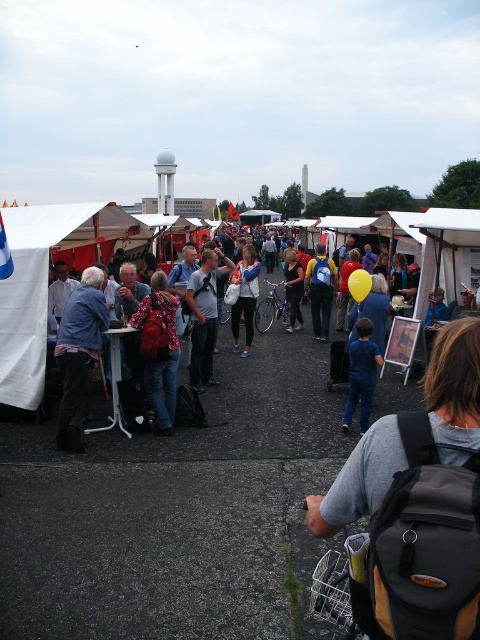
Question: Among these points, which one is nearest to the camera?

Choices:
 (A) (237, 272)
 (B) (202, 356)
 (C) (357, 380)
 (D) (159, 369)

Answer: (C)

Question: Does red floral backpack at center appear on the right side of yellow rubber balloon at center?

Choices:
 (A) no
 (B) yes

Answer: (A)

Question: Among these points, which one is nearest to the camera?

Choices:
 (A) (286, 284)
 (B) (212, 356)
 (C) (250, 273)
 (D) (348, 284)

Answer: (D)

Question: Can you confirm if blue denim jacket at left is positioned to the left of light blue denim jeans at center?

Choices:
 (A) no
 (B) yes

Answer: (B)

Question: Is blue denim jacket at left thinner than blue denim jeans at center?

Choices:
 (A) yes
 (B) no

Answer: (B)

Question: Based on their relative distances, which object is nearer to the blue denim jeans at center?

Choices:
 (A) blue denim jacket at left
 (B) blue backpack at center
 (C) red floral backpack at center

Answer: (C)